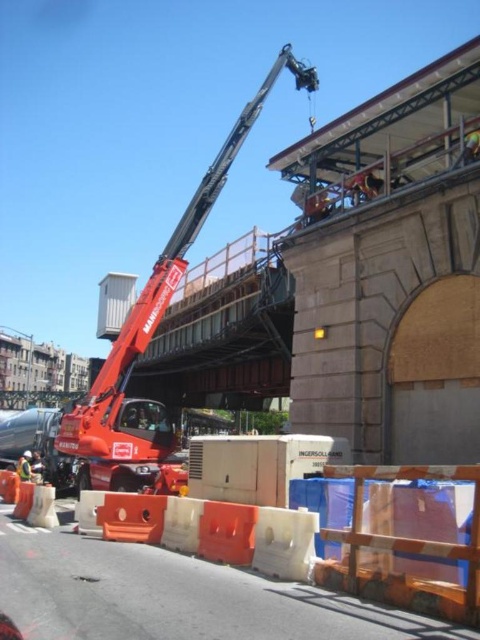
You are a construction worker standing at the scene. You need to place a new white plastic container at upper center so that it is closer to the viewer than the transparent plastic barricade at lower center. Is this possible based on the current setup?

The transparent plastic barricade at lower center is closer to the viewer than the white plastic container at upper center. Therefore, it is not possible to place the new white plastic container at upper center closer to the viewer than the transparent plastic barricade at lower center as per the current setup.

You are a construction worker who needs to store a small tool. You see the transparent plastic barricade at lower center and the white plastic container at upper center. Which object can you use to store the tool?

The white plastic container at upper center can be used to store the tool because it is larger in size compared to the transparent plastic barricade at lower center.

You are a construction worker who needs to determine if the red metallic crane at center can be safely lowered without hitting the white plastic container at upper center. Based on the scene, what should you consider?

The red metallic crane at center is taller than the white plastic container at upper center, so lowering the crane might not hit the container if the crane is lowered vertically. However, ensure there is enough clearance around the container to avoid any contact during the movement.